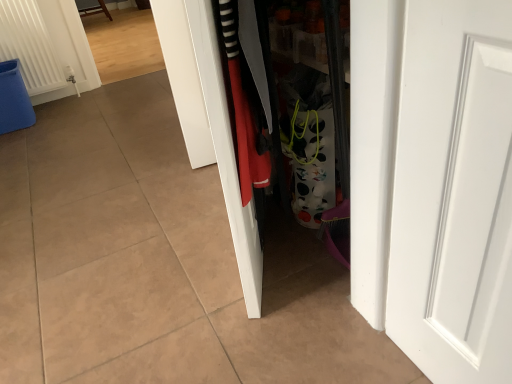
Identify the location of white ribbed radiator at upper left. Image resolution: width=512 pixels, height=384 pixels. (29, 45).

What is the approximate width of white ribbed radiator at upper left?

5.14 inches.

The width and height of the screenshot is (512, 384). Describe the element at coordinates (29, 45) in the screenshot. I see `white ribbed radiator at upper left` at that location.

The height and width of the screenshot is (384, 512). In order to click on white ribbed radiator at upper left in this screenshot , I will do `click(29, 45)`.